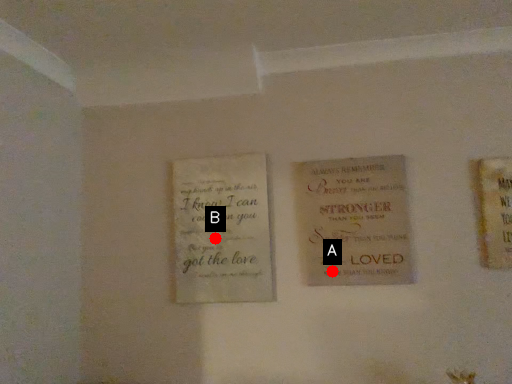
Question: Two points are circled on the image, labeled by A and B beside each circle. Which point is further to the camera?

Choices:
 (A) A is further
 (B) B is further

Answer: (B)